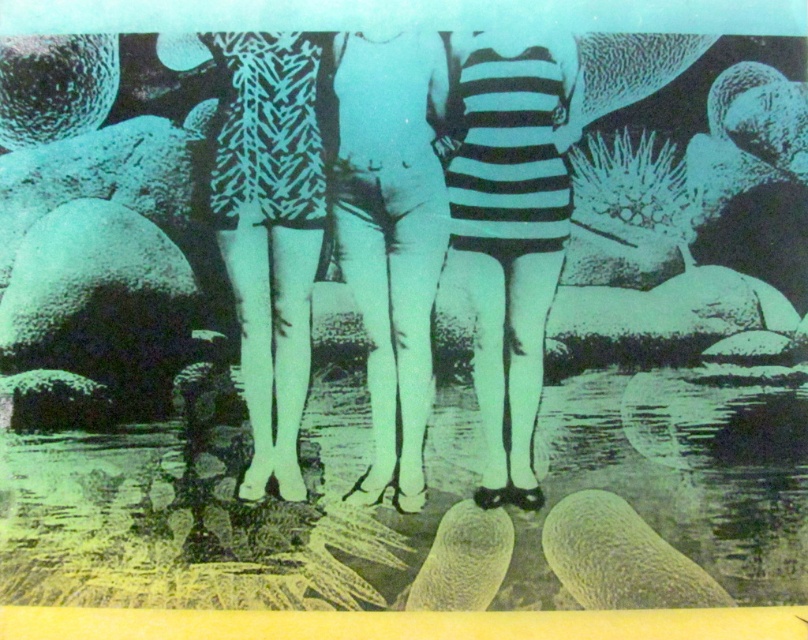
You are a photographer trying to capture a close shot of the scene. You are currently at a position 2 meters away from the point marked at point (511, 259). Can you get closer to this point to take a better photo?

The distance between you and point (511, 259) is 1.84 meters, which is less than the 2 meters you mentioned. Therefore, you are already closer than 2 meters, so you can take the photo from your current position.

You are a photographer analyzing the image. You notice two central figures wearing the striped fabric dress at center and the white matte swimsuit at center. Which clothing item is shorter in height?

The striped fabric dress at center is not as tall as the white matte swimsuit at center, so the striped fabric dress at center is shorter in height.

You are standing in the scene and want to place a small seashell exactly at point (508, 234). According to the image, where will the seashell be placed?

The point (508, 234) is on striped fabric dress at center, so the seashell will be placed on the striped fabric dress at center.